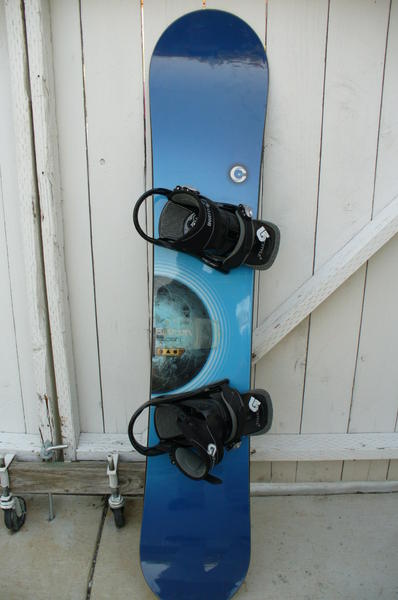
Image resolution: width=398 pixels, height=600 pixels. In order to click on vertical painted boards in this screenshot , I will do `click(372, 412)`, `click(330, 410)`, `click(287, 406)`, `click(126, 132)`, `click(89, 389)`, `click(29, 390)`, `click(9, 417)`.